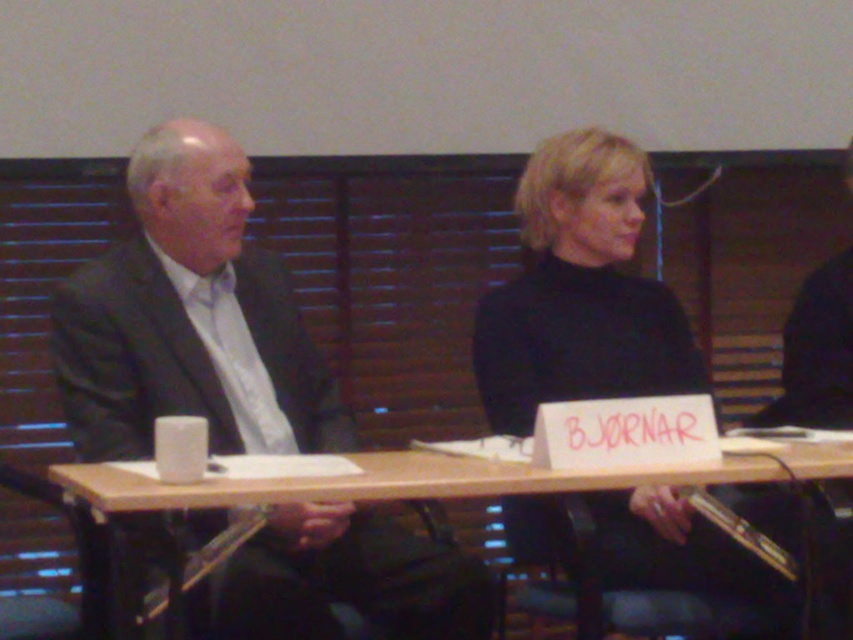
You are a photographer standing at the camera position. You want to capture a closeup of the black matte turtleneck at center without moving the camera. Is it possible to do so with the current setup?

The black matte turtleneck at center and camera are 2.19 meters apart from each other. Since the photographer is at the camera position and the distance is fixed, capturing a closeup would require adjusting the camera settings or using a zoom lens to focus on the black matte turtleneck at center without moving the camera.

You are organizing a panel discussion and need to place a nameplate for the person in the dark gray suit at left. Where should you place it relative to the wooden table at center?

The wooden table at center is behind the dark gray suit at left, so the nameplate should be placed in front of the dark gray suit at left, likely on the table surface where it can be easily seen by the audience.

You are an event organizer arranging seating for a panel discussion. You need to ensure that the dark gray suit at left and the black matte turtleneck at center are visible to the audience. Which of the two should be seated in a taller chair to ensure visibility?

The dark gray suit at left has a lesser height compared to the black matte turtleneck at center. Therefore, the dark gray suit at left should be seated in a taller chair to ensure visibility.